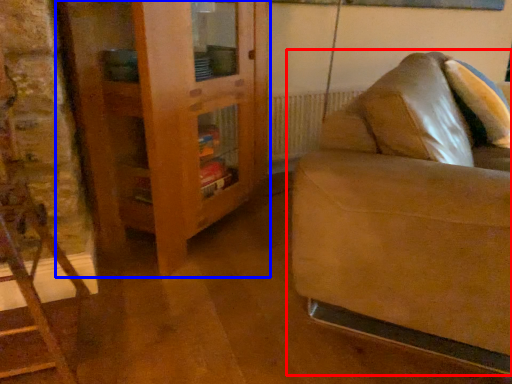
Question: Among these objects, which one is nearest to the camera, studio couch (highlighted by a red box) or dresser (highlighted by a blue box)?

Choices:
 (A) studio couch
 (B) dresser

Answer: (A)